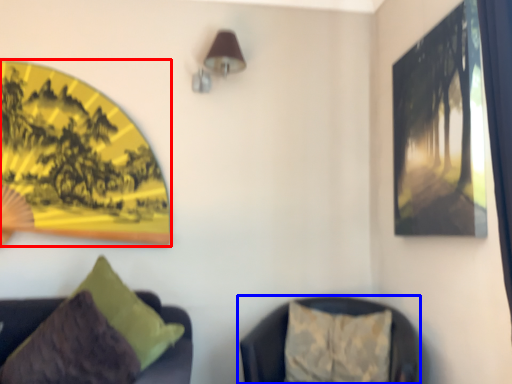
Question: Among these objects, which one is nearest to the camera, picture frame (highlighted by a red box) or furniture (highlighted by a blue box)?

Choices:
 (A) picture frame
 (B) furniture

Answer: (B)